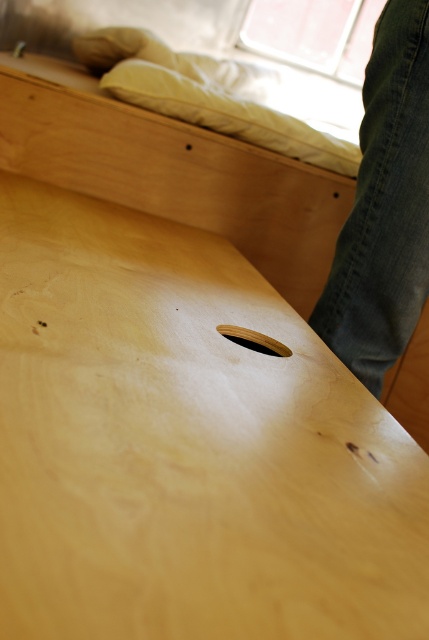
Question: Does natural wood plywood at center have a larger size compared to natural wood bed at center?

Choices:
 (A) no
 (B) yes

Answer: (B)

Question: Is natural wood plywood at center bigger than wooden hole at center?

Choices:
 (A) no
 (B) yes

Answer: (B)

Question: Which object appears closest to the camera in this image?

Choices:
 (A) natural wood bed at center
 (B) dark blue jeans at right
 (C) natural wood plywood at center

Answer: (C)

Question: Among these objects, which one is nearest to the camera?

Choices:
 (A) natural wood plywood at center
 (B) wooden hole at center
 (C) dark blue jeans at right

Answer: (A)

Question: Is dark blue jeans at right thinner than wooden hole at center?

Choices:
 (A) no
 (B) yes

Answer: (A)

Question: Which object is the closest to the dark blue jeans at right?

Choices:
 (A) natural wood plywood at center
 (B) natural wood bed at center

Answer: (B)